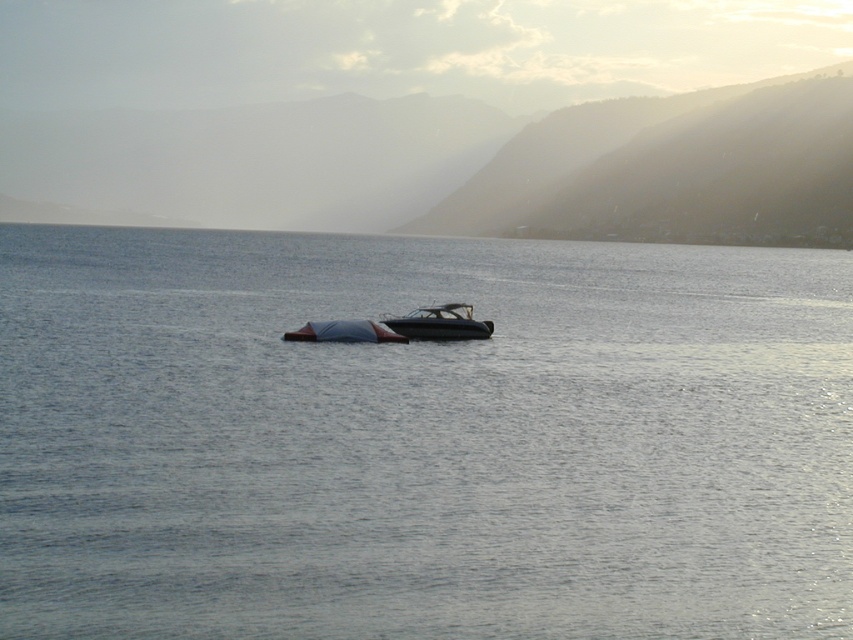
Question: Can you confirm if clear water at center is positioned below shiny blue boat at center?

Choices:
 (A) no
 (B) yes

Answer: (A)

Question: Which object is the closest to the clear water at center?

Choices:
 (A) shiny blue boat at center
 (B) glossy black boat at center

Answer: (B)

Question: Observing the image, what is the correct spatial positioning of clear water at center in reference to glossy black boat at center?

Choices:
 (A) left
 (B) right

Answer: (B)

Question: Is clear water at center positioned at the back of shiny blue boat at center?

Choices:
 (A) yes
 (B) no

Answer: (B)

Question: Estimate the real-world distances between objects in this image. Which object is farther from the clear water at center?

Choices:
 (A) glossy black boat at center
 (B) shiny blue boat at center

Answer: (B)

Question: Which point is closer to the camera taking this photo?

Choices:
 (A) (492, 332)
 (B) (322, 328)

Answer: (B)